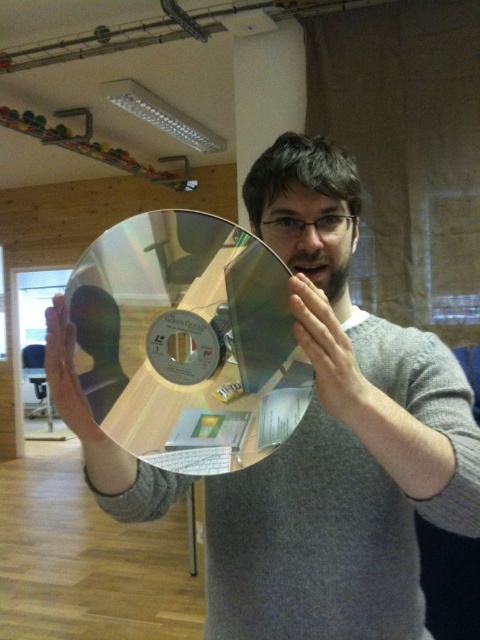
Question: Is metallic silver disc at center below matte metallic face at center?

Choices:
 (A) yes
 (B) no

Answer: (A)

Question: Which point is farther to the camera?

Choices:
 (A) metallic silver disc at center
 (B) metallic gold at center
 (C) matte gold disc at center
 (D) matte metallic face at center

Answer: (D)

Question: Is metallic gold at center to the left of matte gold disc at center from the viewer's perspective?

Choices:
 (A) no
 (B) yes

Answer: (A)

Question: Which object is positioned closest to the metallic silver disc at center?

Choices:
 (A) metallic gold at center
 (B) matte metallic face at center
 (C) matte gold disc at center

Answer: (A)

Question: Which object is positioned farthest from the metallic gold at center?

Choices:
 (A) metallic silver disc at center
 (B) matte metallic face at center

Answer: (B)

Question: From the image, what is the correct spatial relationship of metallic gold at center in relation to matte gold disc at center?

Choices:
 (A) left
 (B) right

Answer: (B)